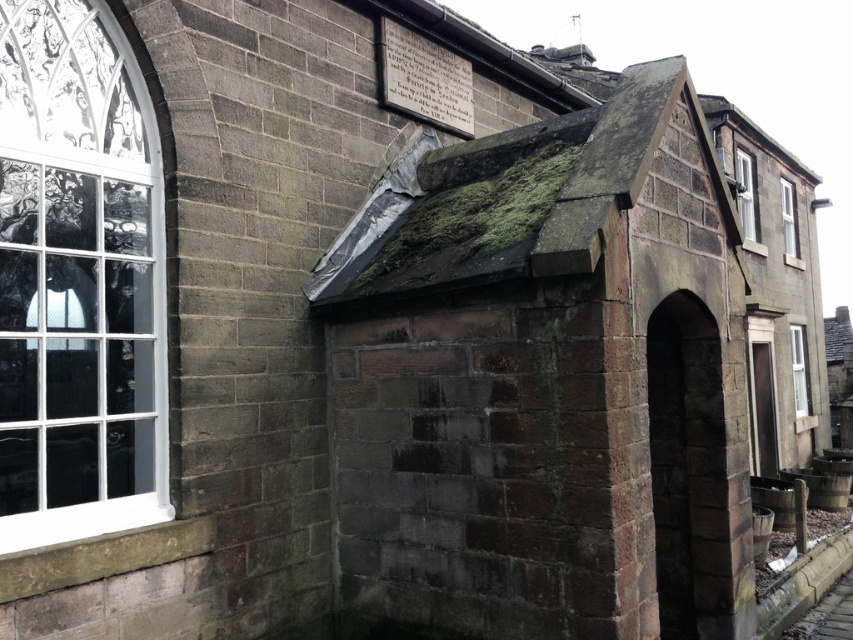
Is white glass window at left bigger than clear glass window at upper right?

Yes.

Who is more forward, (134, 481) or (786, 244)?

Point (134, 481)

Find the location of `white glass window at left`. white glass window at left is located at coordinates (78, 280).

Measure the distance between point (x=799, y=404) and camera.

A distance of 45.87 feet exists between point (x=799, y=404) and camera.

The height and width of the screenshot is (640, 853). In order to click on white plastic window at right in this screenshot , I will do `click(799, 376)`.

You are a GUI agent. You are given a task and a screenshot of the screen. Output one action in this format:
    pyautogui.click(x=<x>, y=<y>)
    Task: Click on the white plastic window at right
    This screenshot has height=640, width=853.
    Given the screenshot: What is the action you would take?
    pyautogui.click(x=799, y=376)

Who is higher up, green mossy roof at upper center or white plastic window at right?

Result: green mossy roof at upper center

Can you confirm if green mossy roof at upper center is positioned above white plastic window at right?

Yes.

Is point (491, 212) less distant than point (792, 337)?

That is True.

You are a GUI agent. You are given a task and a screenshot of the screen. Output one action in this format:
    pyautogui.click(x=<x>, y=<y>)
    Task: Click on the green mossy roof at upper center
    The image size is (853, 640).
    Given the screenshot: What is the action you would take?
    474,216